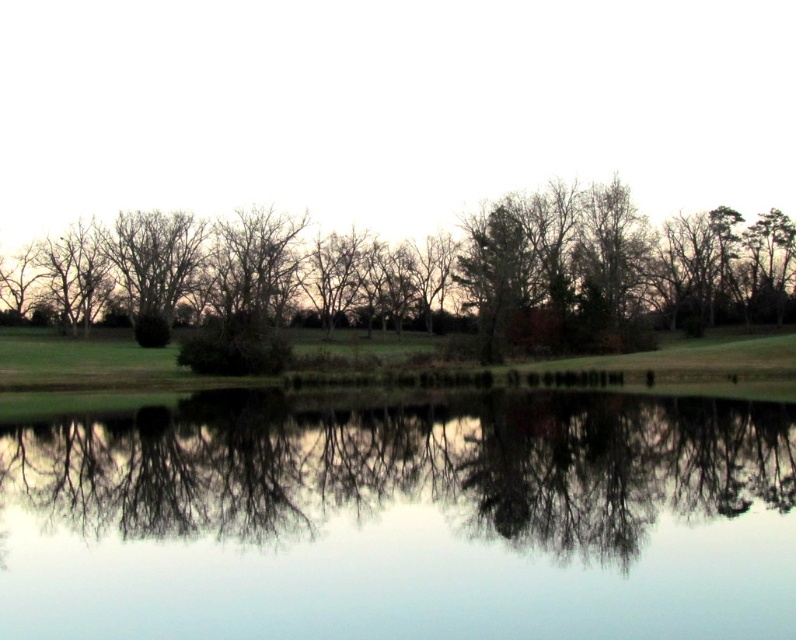
Question: Which point is closer to the camera taking this photo?

Choices:
 (A) (2, 579)
 (B) (90, 260)

Answer: (A)

Question: Does transparent water at center appear on the left side of green leafy tree at center?

Choices:
 (A) no
 (B) yes

Answer: (B)

Question: Which of the following is the farthest from the observer?

Choices:
 (A) green leafy tree at center
 (B) transparent water at center

Answer: (A)

Question: Considering the relative positions of transparent water at center and green leafy tree at center in the image provided, where is transparent water at center located with respect to green leafy tree at center?

Choices:
 (A) right
 (B) left

Answer: (B)

Question: Does transparent water at center have a greater width compared to green leafy tree at center?

Choices:
 (A) no
 (B) yes

Answer: (A)

Question: Which object appears closest to the camera in this image?

Choices:
 (A) green leafy tree at center
 (B) transparent water at center

Answer: (B)